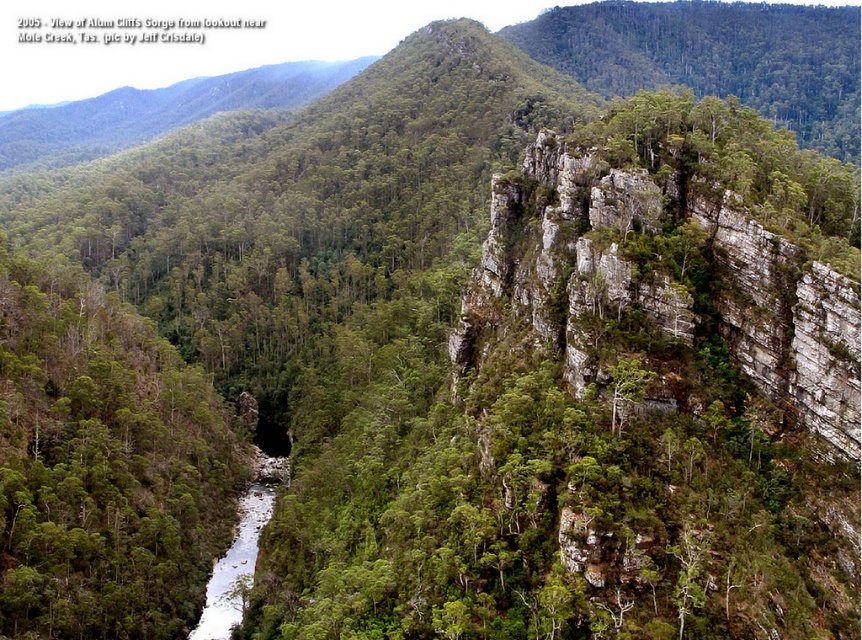
You are standing at the lookout and want to take a photo of both the green leafy tree at lower left and the white smooth river at center. Which object should you focus on first to ensure both are in the frame?

You should focus on the green leafy tree at lower left first because it is closer to the viewer than the white smooth river at center, so adjusting the camera to include the closer object first will help frame both properly.

You are standing at the point marked at coordinate [159,605]. The nearest cliff edge is 113.41 meters away. Can you safely walk towards the cliff edge without any obstacles?

The nearest cliff edge is 113.41 meters away from the point marked at coordinate [159,605], so you can safely walk towards the cliff edge without any obstacles.

You are standing at the lookout near Mole Creek, Tasmania, and see two points marked in the image. Which point, point (223,490) or point (253,564), is closer to you?

Point (223,490) is closer to you because it is further to the viewer than point (253,564).